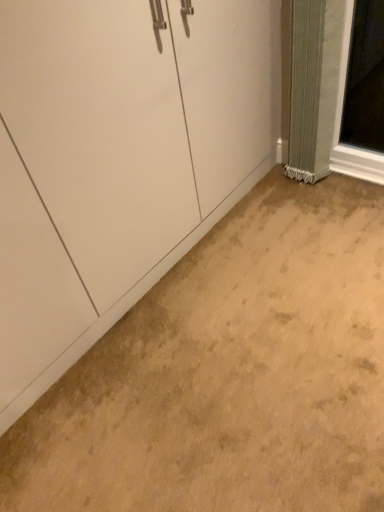
Question: Should I look upward or downward to see beige carpet at lower center?

Choices:
 (A) up
 (B) down

Answer: (B)

Question: Is beige carpet at lower center facing away from green textured curtain at right?

Choices:
 (A) yes
 (B) no

Answer: (B)

Question: From the image's perspective, is beige carpet at lower center below green textured curtain at right?

Choices:
 (A) yes
 (B) no

Answer: (A)

Question: Can you confirm if beige carpet at lower center is thinner than green textured curtain at right?

Choices:
 (A) no
 (B) yes

Answer: (A)

Question: Considering the relative sizes of beige carpet at lower center and green textured curtain at right in the image provided, is beige carpet at lower center taller than green textured curtain at right?

Choices:
 (A) no
 (B) yes

Answer: (A)

Question: Is beige carpet at lower center facing towards green textured curtain at right?

Choices:
 (A) yes
 (B) no

Answer: (B)

Question: Does beige carpet at lower center have a smaller size compared to green textured curtain at right?

Choices:
 (A) yes
 (B) no

Answer: (B)

Question: Considering the relative sizes of green textured curtain at right and beige carpet at lower center in the image provided, is green textured curtain at right bigger than beige carpet at lower center?

Choices:
 (A) no
 (B) yes

Answer: (A)

Question: Does green textured curtain at right come behind beige carpet at lower center?

Choices:
 (A) no
 (B) yes

Answer: (B)

Question: Considering the relative sizes of green textured curtain at right and beige carpet at lower center in the image provided, is green textured curtain at right taller than beige carpet at lower center?

Choices:
 (A) no
 (B) yes

Answer: (B)

Question: Is green textured curtain at right facing away from beige carpet at lower center?

Choices:
 (A) yes
 (B) no

Answer: (B)

Question: Is green textured curtain at right far away from beige carpet at lower center?

Choices:
 (A) yes
 (B) no

Answer: (B)

Question: Does green textured curtain at right come in front of beige carpet at lower center?

Choices:
 (A) no
 (B) yes

Answer: (A)

Question: Looking at the image, does beige carpet at lower center seem bigger or smaller compared to green textured curtain at right?

Choices:
 (A) small
 (B) big

Answer: (B)